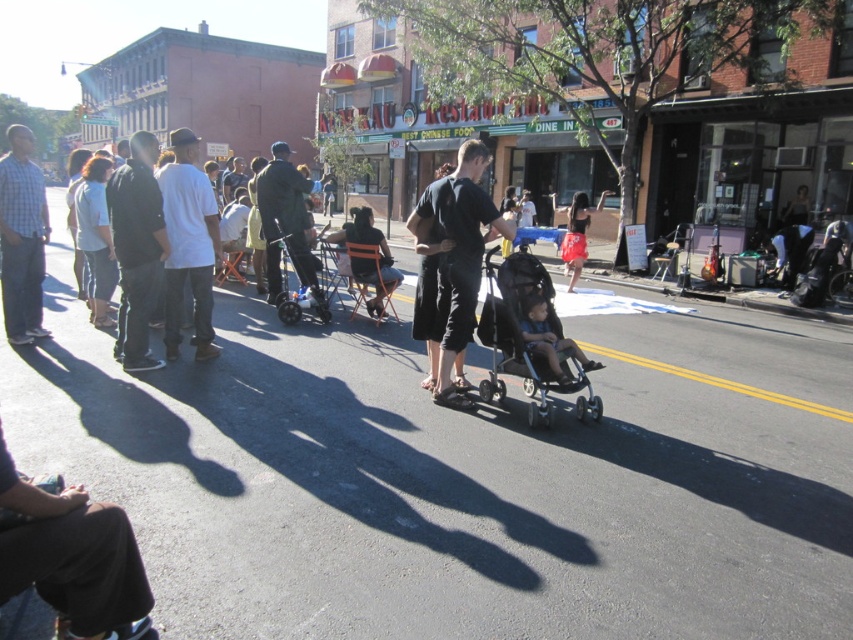
You are standing at the camera position and want to throw a frisbee to a friend. There are two points marked in the scene. Which point, point (491, 209) or point (579, 381), is closer to you where you can throw the frisbee more accurately?

Point (491, 209) is closer to the camera than point (579, 381), so you should throw the frisbee to point (491, 209) for better accuracy.

You are a parent with a baby who needs to navigate through a narrow doorway that is 60 cm tall. You have two strollers available, the black matte stroller at center and the black textured stroller at center. Which stroller should you choose to ensure it fits through the doorway?

The black matte stroller at center has a lesser height compared to the black textured stroller at center, so you should choose the black matte stroller at center to ensure it fits through the 60 cm tall doorway.

In the scene shown: You are standing at the camera position and want to walk to both points. Which point should you reach first, point [122,243] or point [268,284]?

You should reach point [122,243] first because it is closer to the camera than point [268,284].